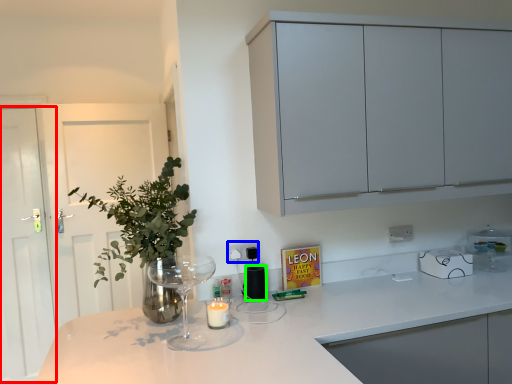
Question: Considering the real-world distances, which object is farthest from glass door (highlighted by a red box)? electric outlet (highlighted by a blue box) or appliance (highlighted by a green box)?

Choices:
 (A) electric outlet
 (B) appliance

Answer: (B)